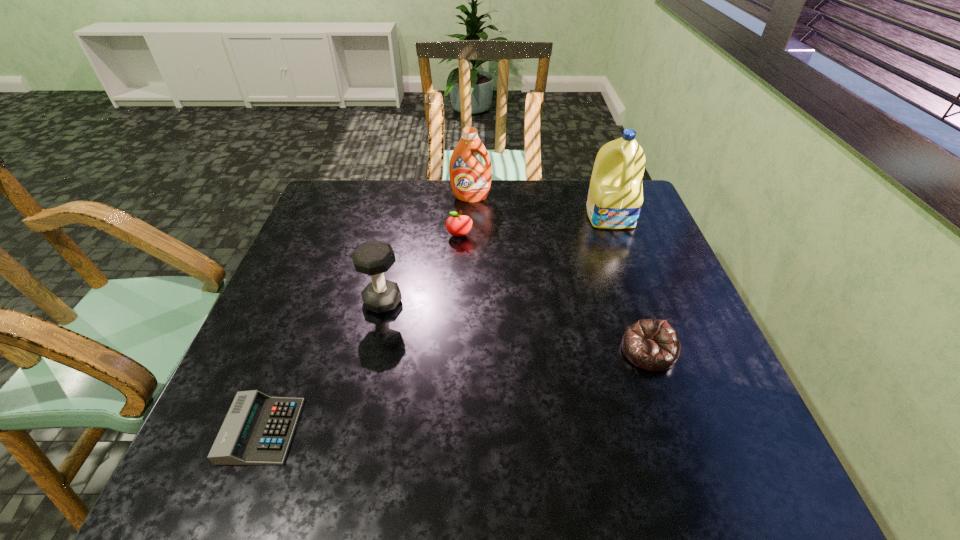
Image resolution: width=960 pixels, height=540 pixels. In order to click on the nearest object in this screenshot , I will do `click(258, 429)`.

Where is `the leftmost object`? This screenshot has width=960, height=540. the leftmost object is located at coordinates (258, 429).

Identify the location of free location located on the label of the right detergent. tap(620, 241).

Where is `free space located on the front-facing side of the left detergent`? The height and width of the screenshot is (540, 960). free space located on the front-facing side of the left detergent is located at coordinates (469, 251).

This screenshot has width=960, height=540. Identify the location of vacant area situated 0.300m on the back of the second object from left to right. (401, 218).

Locate an element on the screen. The image size is (960, 540). free region located on the front of the apple is located at coordinates (456, 296).

I want to click on vacant point located on the left of the fifth tallest object, so click(x=440, y=351).

Identify the location of free region located on the back of the shortest object. The width and height of the screenshot is (960, 540). (294, 348).

The image size is (960, 540). I want to click on object located in the near edge section of the desktop, so click(x=258, y=429).

What are the coordinates of `object at the left edge` in the screenshot? It's located at (258, 429).